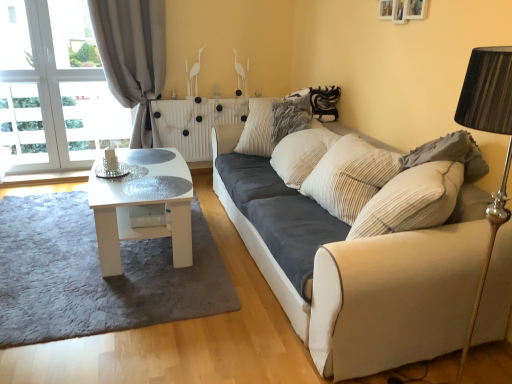
What are the coordinates of `free location above transparent glass table at center (from a real-world perspective)` in the screenshot? It's located at (152, 183).